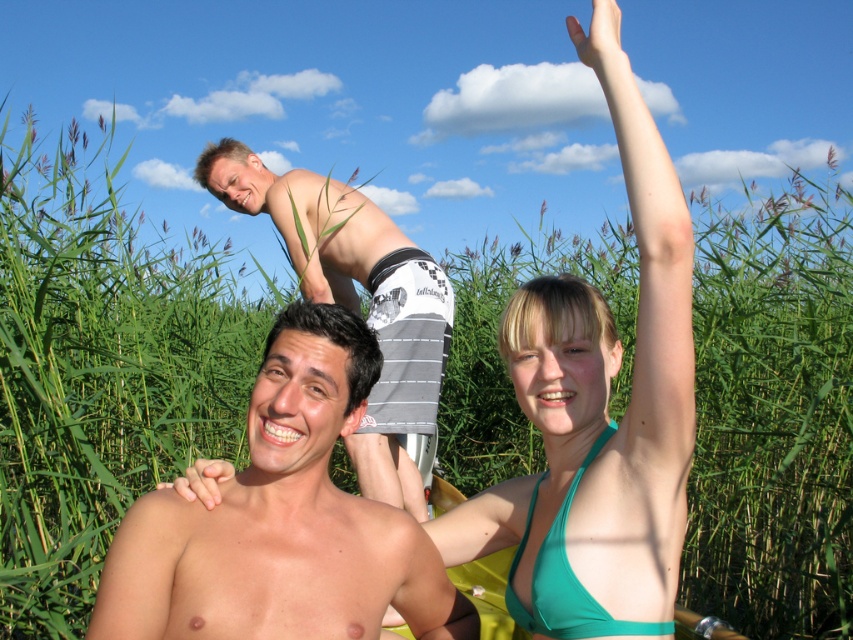
In the image, there are two people sitting and one person on a boat. The two seated people are smiling at the camera. The third person is on a yellow boat behind them. Can you tell me which of the three people is represented by the point at coordinates (x=283, y=518)?

The point at coordinates (x=283, y=518) represents the smooth skin man at center.

You are standing at the point marked by coordinates point (520, 506). You want to walk to the nearest person. How far will you have to walk?

The nearest person is 1.96 meters away from point (520, 506).